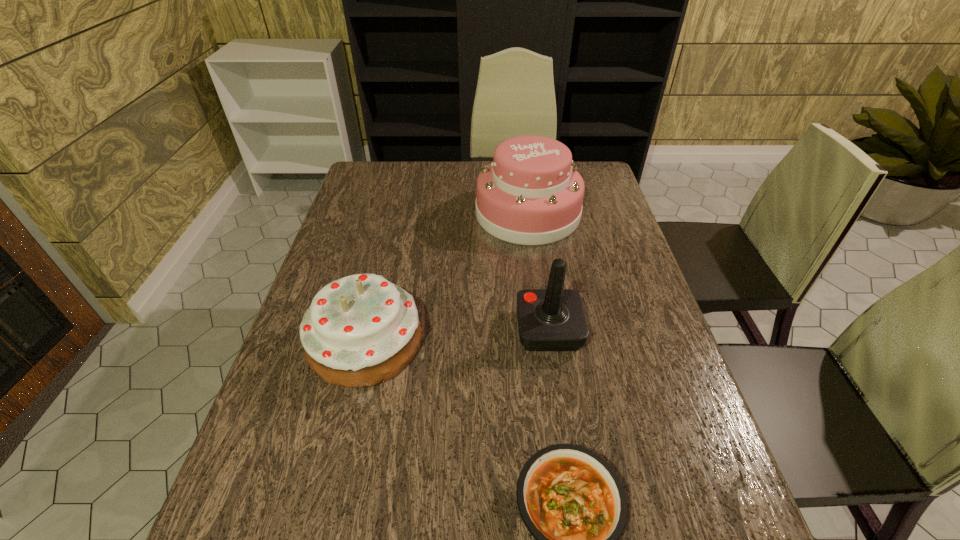
Where is `object that is positioned at the right edge`? The height and width of the screenshot is (540, 960). object that is positioned at the right edge is located at coordinates click(x=531, y=194).

Find the location of `object at the far right corner`. object at the far right corner is located at coordinates (531, 194).

The height and width of the screenshot is (540, 960). In the image, there is a desktop. What are the coordinates of `free space at the far edge` in the screenshot? It's located at (464, 164).

Find the location of a particular element. The height and width of the screenshot is (540, 960). vacant region at the left edge of the desktop is located at coordinates (365, 264).

Where is `vacant space at the right edge`? vacant space at the right edge is located at coordinates (660, 397).

Find the location of a particular element. free point at the far left corner is located at coordinates (355, 178).

At what (x,y) coordinates should I click in order to perform the action: click on vacant area that lies between the farthest object and the joystick. Please return your answer as a coordinate pair (x, y). This screenshot has width=960, height=540. Looking at the image, I should click on (539, 272).

Locate an element on the screen. The width and height of the screenshot is (960, 540). object that is the closest to the joystick is located at coordinates (361, 330).

Where is `the second closest object to the second shortest object`? The height and width of the screenshot is (540, 960). the second closest object to the second shortest object is located at coordinates (572, 502).

At what (x,y) coordinates should I click in order to perform the action: click on vacant space that satisfies the following two spatial constraints: 1. on the back side of the farthest object; 2. on the right side of the second shortest object. Please return your answer as a coordinate pair (x, y). The width and height of the screenshot is (960, 540). Looking at the image, I should click on (396, 213).